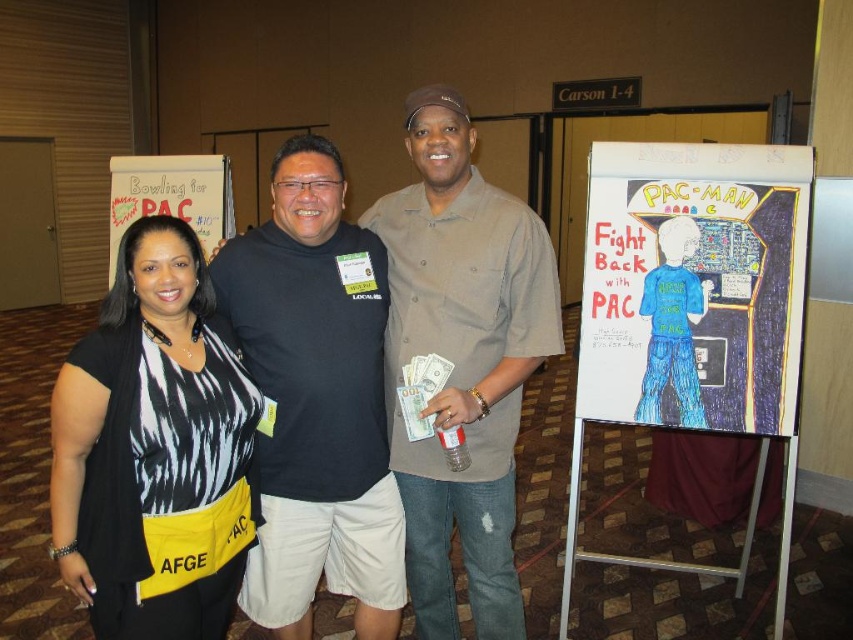
Question: Does matte khaki shirt at center appear over colored paper drawing of pac-man at right?

Choices:
 (A) yes
 (B) no

Answer: (B)

Question: Which point is farther from the camera taking this photo?

Choices:
 (A) (332, 529)
 (B) (194, 608)

Answer: (A)

Question: Which of the following is the farthest from the observer?

Choices:
 (A) colored paper drawing of pac-man at right
 (B) colored paper drawing at right
 (C) black and white printed shirt at center
 (D) matte khaki shirt at center

Answer: (A)

Question: Among these objects, which one is nearest to the camera?

Choices:
 (A) white paper poster at upper left
 (B) black cotton shirt at center

Answer: (B)

Question: Does colored paper drawing at right lie in front of matte khaki shirt at center?

Choices:
 (A) no
 (B) yes

Answer: (A)

Question: Does matte khaki shirt at center have a larger size compared to white paper poster at upper left?

Choices:
 (A) yes
 (B) no

Answer: (B)